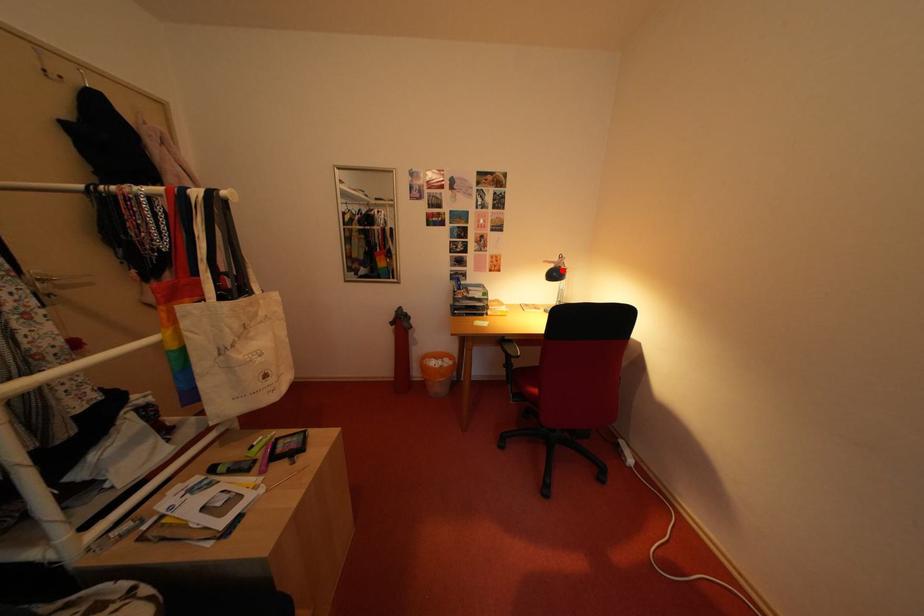
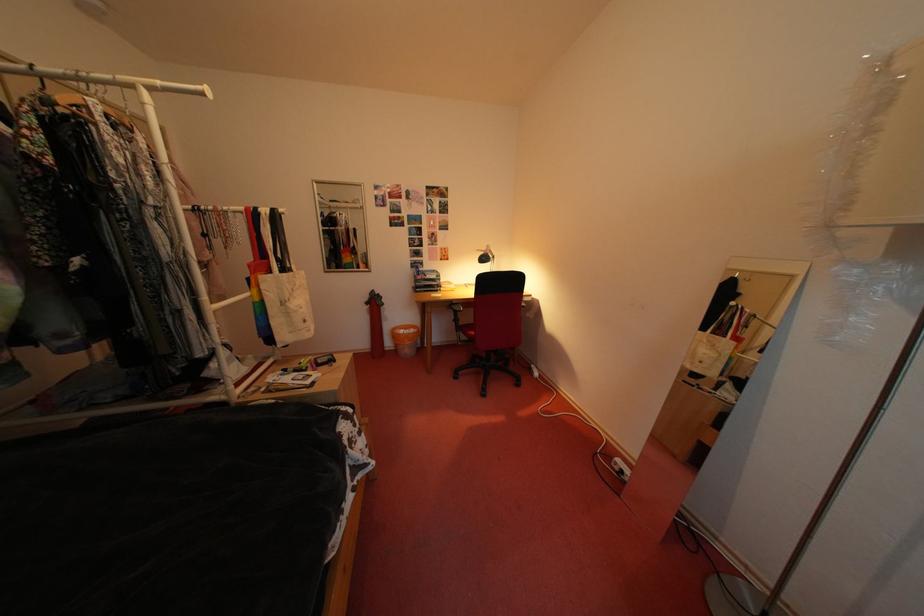
In the second image, find the point that corresponds to the highlighted location in the first image.

(492, 257)